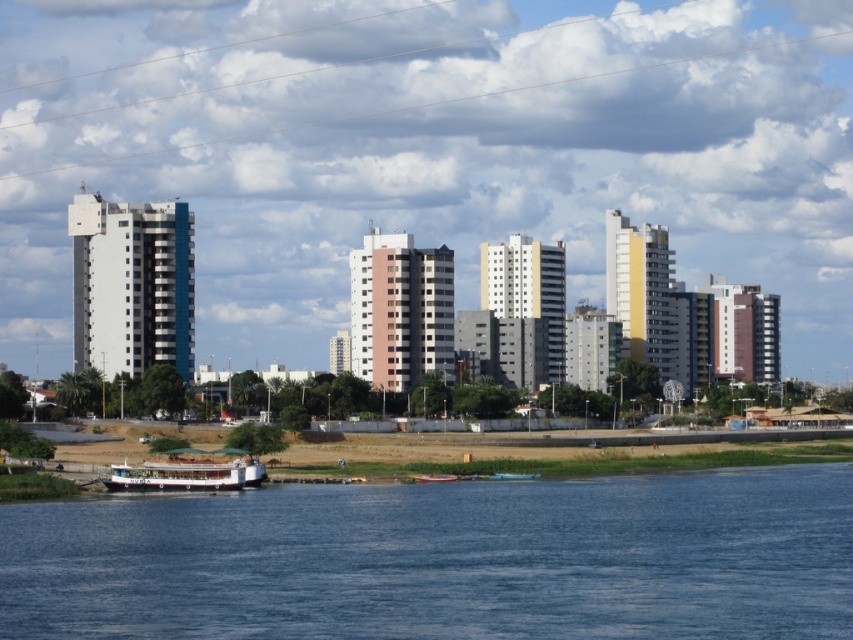
Consider the image. You are a photographer planning to capture the entire scene in one shot. Given that the blue water at lower center and the white matte boat at lower center are both in your frame, which one occupies more space in the photo?

The blue water at lower center occupies more space in the photo because it is bigger than the white matte boat at lower center according to the description.

You are standing at the riverside and see two points marked in the image. The first point is at coordinates point (515, 508) and the second is at point (424, 474). Which point is closer to you?

Point (515, 508) is in front of point (424, 474), so it is closer to you.

You are standing on the riverside and see the blue water at lower center and the white matte boat at lower center. Which object is closer to you?

The blue water at lower center is closer to you because it is positioned in front of the white matte boat at lower center.